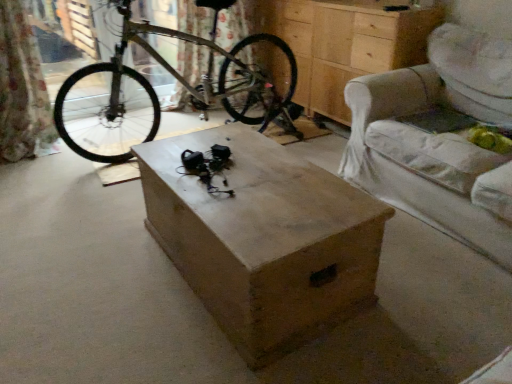
Where is `vacant area on top of wooden box at center (from a real-world perspective)`? vacant area on top of wooden box at center (from a real-world perspective) is located at coordinates (211, 150).